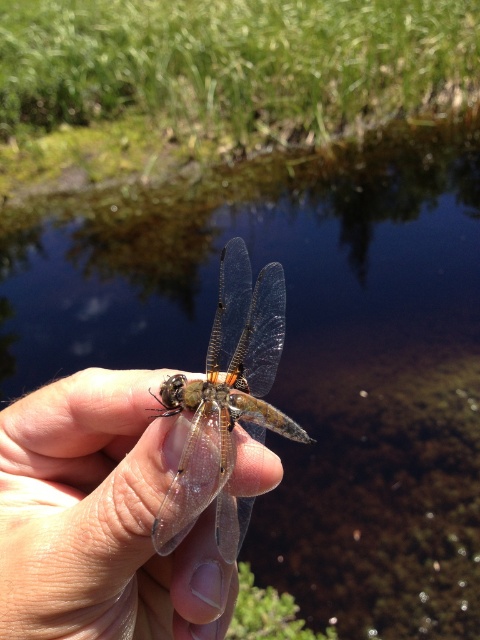
Question: Which of the following is the farthest from the observer?

Choices:
 (A) transparent glass dragonfly at center
 (B) translucent skin at center

Answer: (B)

Question: Does translucent skin at center have a greater width compared to transparent glass dragonfly at center?

Choices:
 (A) no
 (B) yes

Answer: (B)

Question: Can you confirm if translucent skin at center is bigger than transparent glass dragonfly at center?

Choices:
 (A) yes
 (B) no

Answer: (A)

Question: Does translucent skin at center have a lesser width compared to transparent glass dragonfly at center?

Choices:
 (A) yes
 (B) no

Answer: (B)